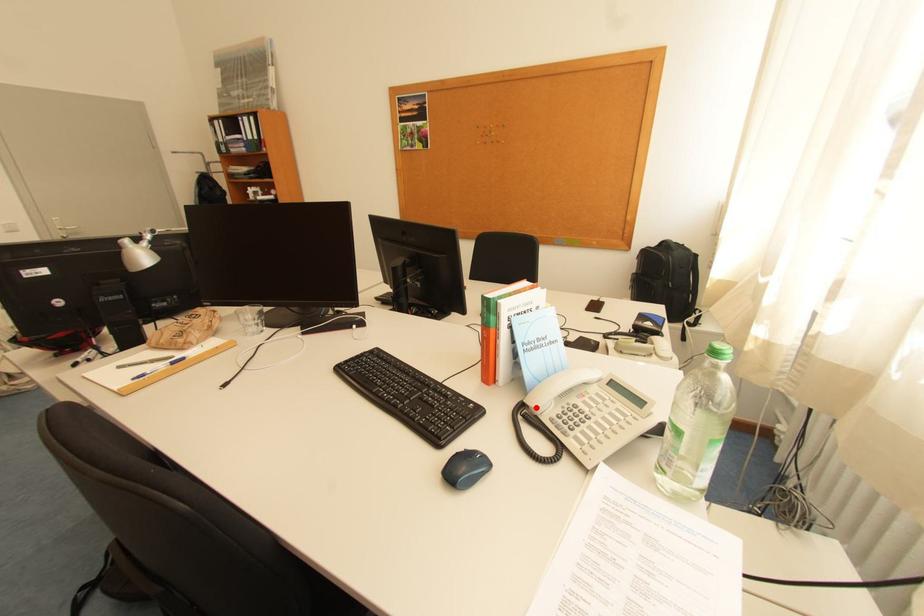
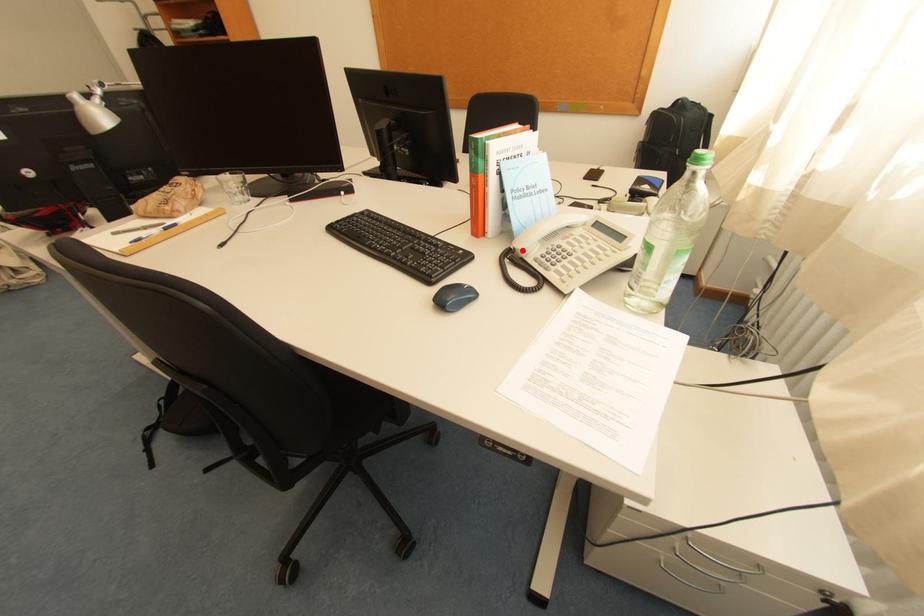
I am providing you with two images of the same scene from different viewpoints. A red point is marked on the first image and another point is marked on the second image. Do the highlighted points in image1 and image2 indicate the same real-world spot?

Yes